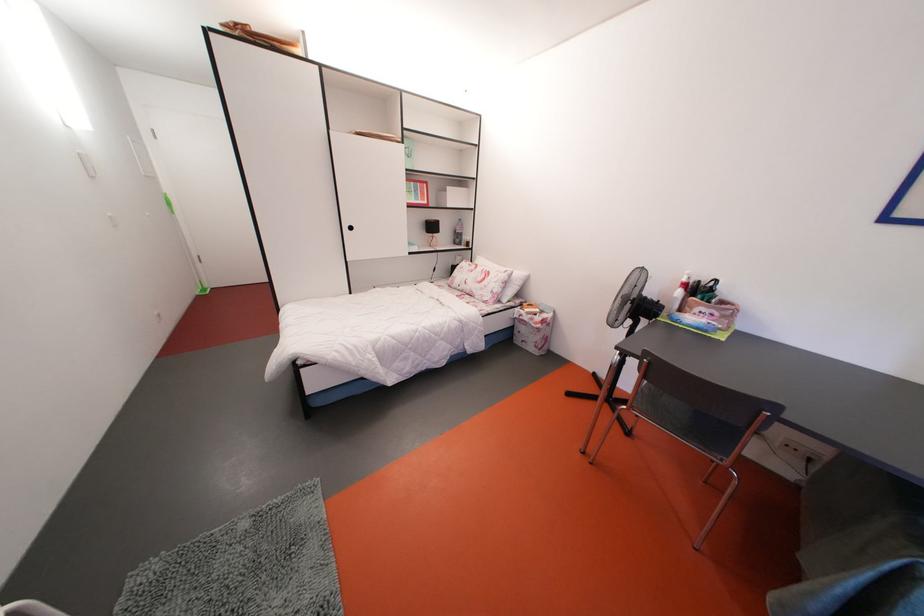
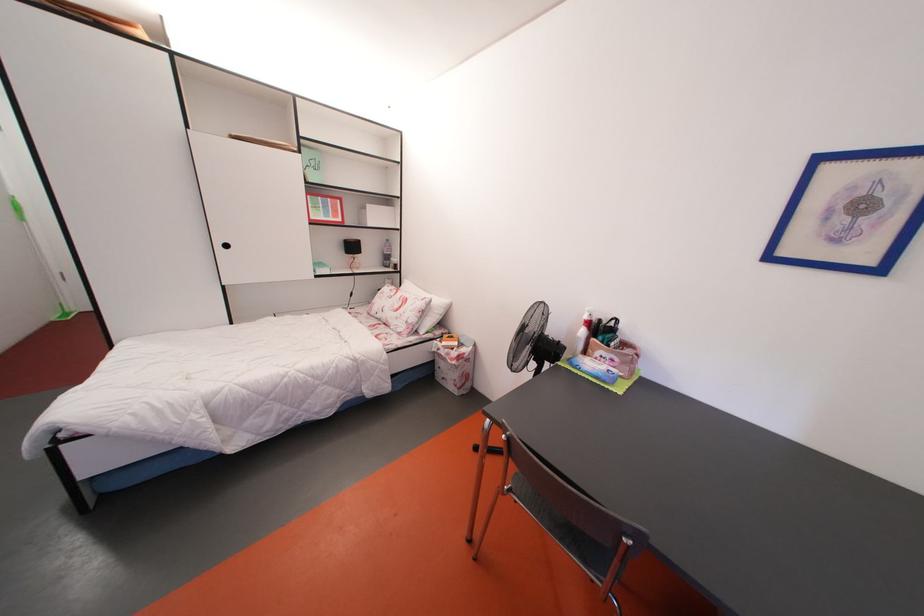
Locate, in the second image, the point that corresponds to [533,325] in the first image.

(450, 360)